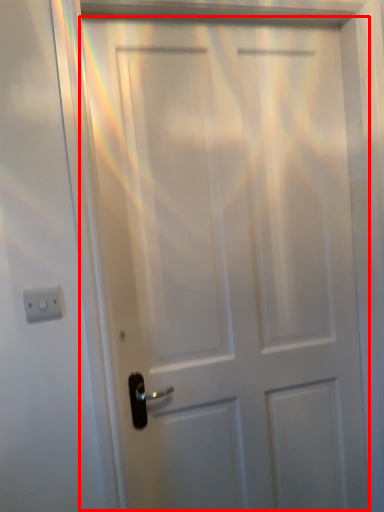
Question: From the image's perspective, what is the correct spatial positioning of door (annotated by the red box) in reference to light switch?

Choices:
 (A) above
 (B) below

Answer: (B)